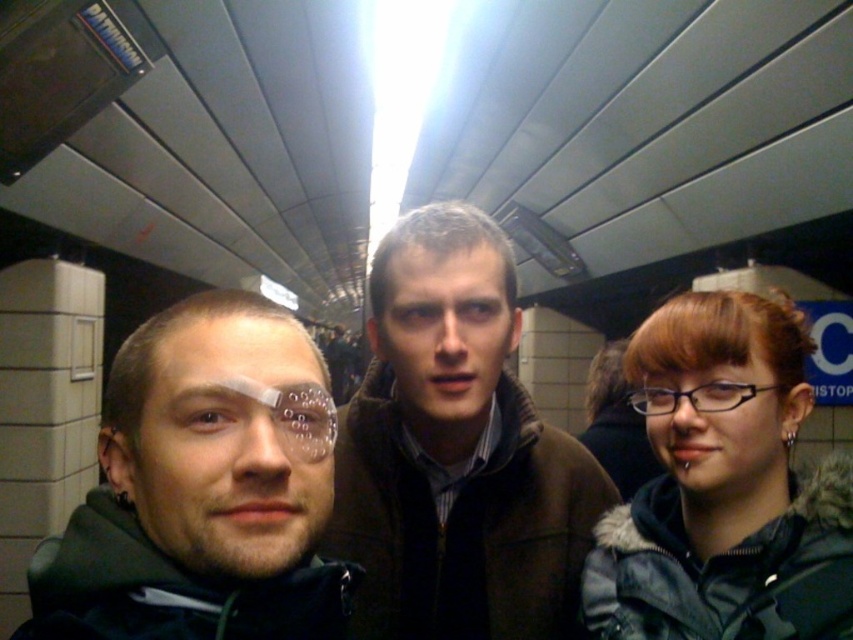
Looking at this image, between brown fuzzy jacket at center and dark green jacket at left, which one has more height?

Standing taller between the two is brown fuzzy jacket at center.

Is brown fuzzy jacket at center to the right of dark green jacket at left from the viewer's perspective?

Indeed, brown fuzzy jacket at center is positioned on the right side of dark green jacket at left.

You are a GUI agent. You are given a task and a screenshot of the screen. Output one action in this format:
    pyautogui.click(x=<x>, y=<y>)
    Task: Click on the brown fuzzy jacket at center
    
    Given the screenshot: What is the action you would take?
    pyautogui.click(x=456, y=451)

Locate an element on the screen. This screenshot has height=640, width=853. brown fuzzy jacket at center is located at coordinates (456, 451).

Is brown fuzzy jacket at center bigger than matte blue jacket at center?

Indeed, brown fuzzy jacket at center has a larger size compared to matte blue jacket at center.

Does brown fuzzy jacket at center lie behind matte blue jacket at center?

Yes.

Image resolution: width=853 pixels, height=640 pixels. Describe the element at coordinates (456, 451) in the screenshot. I see `brown fuzzy jacket at center` at that location.

Identify the location of brown fuzzy jacket at center. (456, 451).

Is point (329, 440) positioned behind point (668, 573)?

No, it is in front of (668, 573).

The height and width of the screenshot is (640, 853). What do you see at coordinates (202, 488) in the screenshot?
I see `dark green jacket at left` at bounding box center [202, 488].

Image resolution: width=853 pixels, height=640 pixels. What do you see at coordinates (202, 488) in the screenshot? I see `dark green jacket at left` at bounding box center [202, 488].

Find the location of a particular element. Image resolution: width=853 pixels, height=640 pixels. dark green jacket at left is located at coordinates (202, 488).